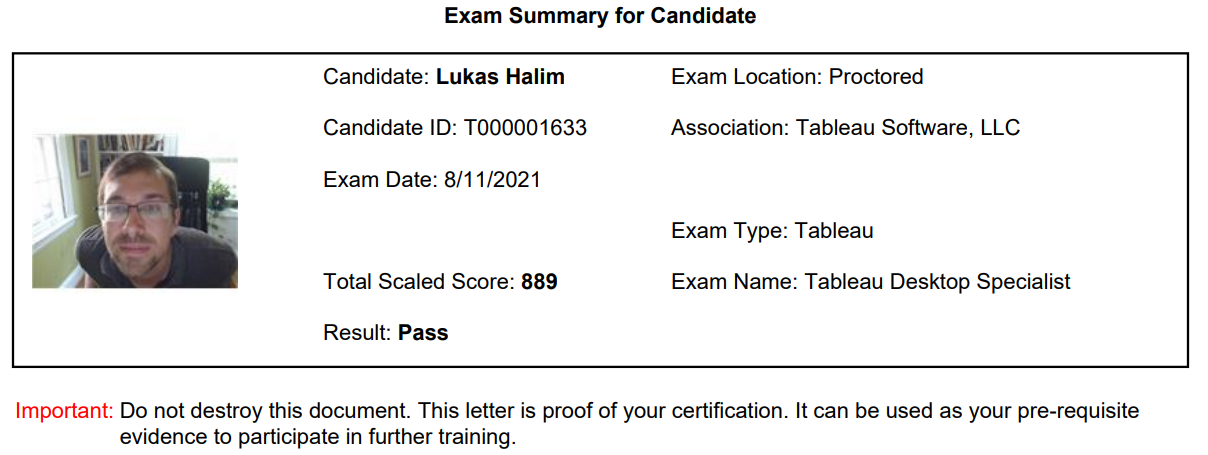
At what (x,y) coordinates should I click in order to perform the action: click on window. Please return your answer as a coordinate pair (x, y). This screenshot has width=1208, height=455. Looking at the image, I should click on (29, 166).